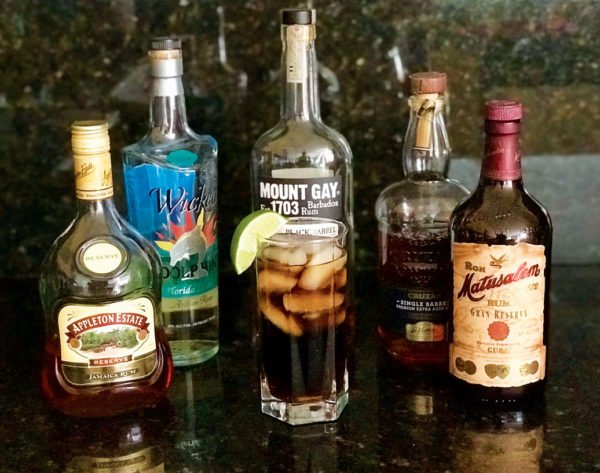
Identify the location of bottle. [133, 266].